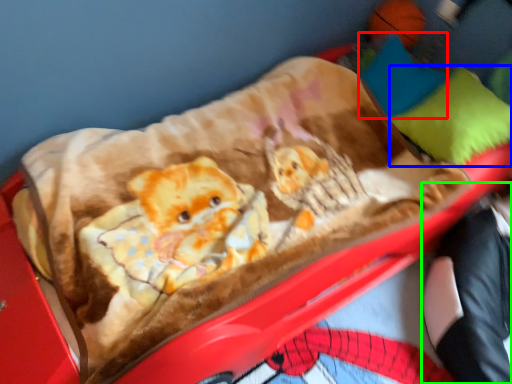
Question: Based on their relative distances, which object is farther from pillow (highlighted by a red box)? Choose from pillow (highlighted by a blue box) and couple (highlighted by a green box).

Choices:
 (A) pillow
 (B) couple

Answer: (B)